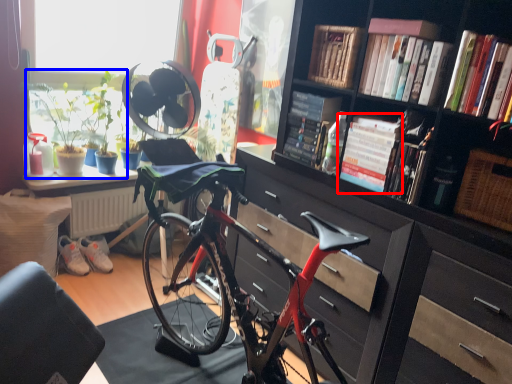
Question: Which object appears farthest to the camera in this image, book (highlighted by a red box) or houseplant (highlighted by a blue box)?

Choices:
 (A) book
 (B) houseplant

Answer: (B)